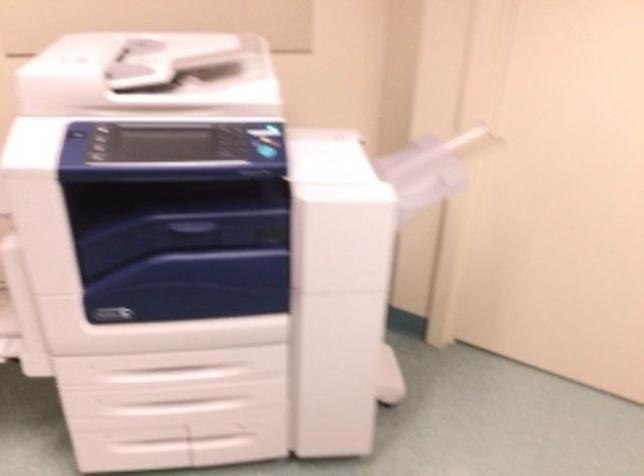
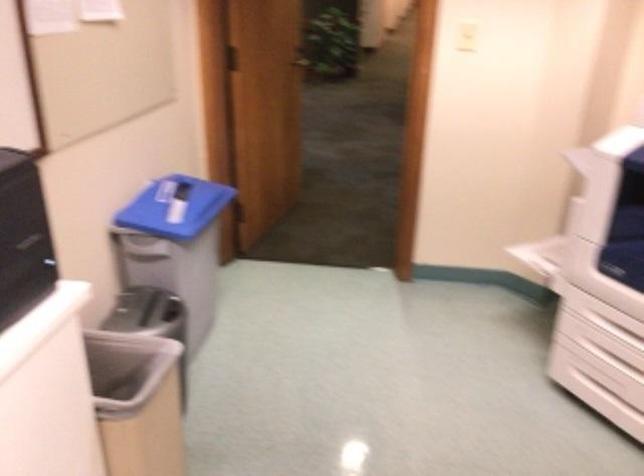
Where in the second image is the point corresponding to [138,370] from the first image?

(618, 330)